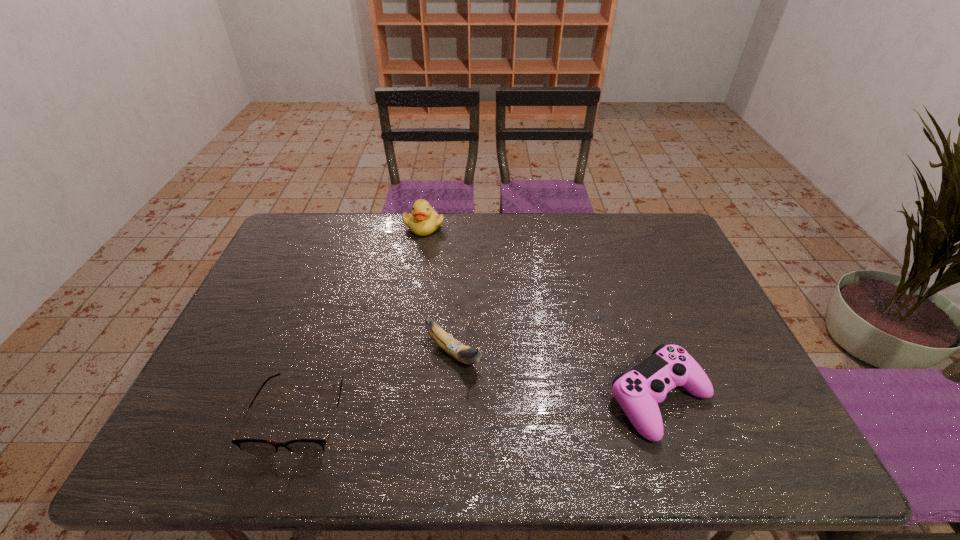
The width and height of the screenshot is (960, 540). I want to click on the leftmost object, so click(x=256, y=447).

Locate an element on the screen. The width and height of the screenshot is (960, 540). spectacles is located at coordinates (256, 447).

Where is `the rightmost object`? Image resolution: width=960 pixels, height=540 pixels. the rightmost object is located at coordinates (637, 392).

Where is `control`? control is located at coordinates (637, 392).

You are a GUI agent. You are given a task and a screenshot of the screen. Output one action in this format:
    pyautogui.click(x=<x>, y=<y>)
    Task: Click on the banana
    
    Given the screenshot: What is the action you would take?
    pyautogui.click(x=465, y=354)

Locate an element on the screen. This screenshot has width=960, height=540. duckling is located at coordinates (424, 220).

You are a GUI agent. You are given a task and a screenshot of the screen. Output one action in this format:
    pyautogui.click(x=<x>, y=<y>)
    Task: Click on the vacant space positioned on the back of the rightmost object
    
    Given the screenshot: What is the action you would take?
    pyautogui.click(x=631, y=315)

Identify the location of free location located at the stem of the banana. (513, 401).

The image size is (960, 540). In order to click on vacant space located at the stem of the banana in this screenshot , I will do `click(503, 393)`.

Locate an element on the screen. The image size is (960, 540). free point located 0.210m at the stem of the banana is located at coordinates (539, 422).